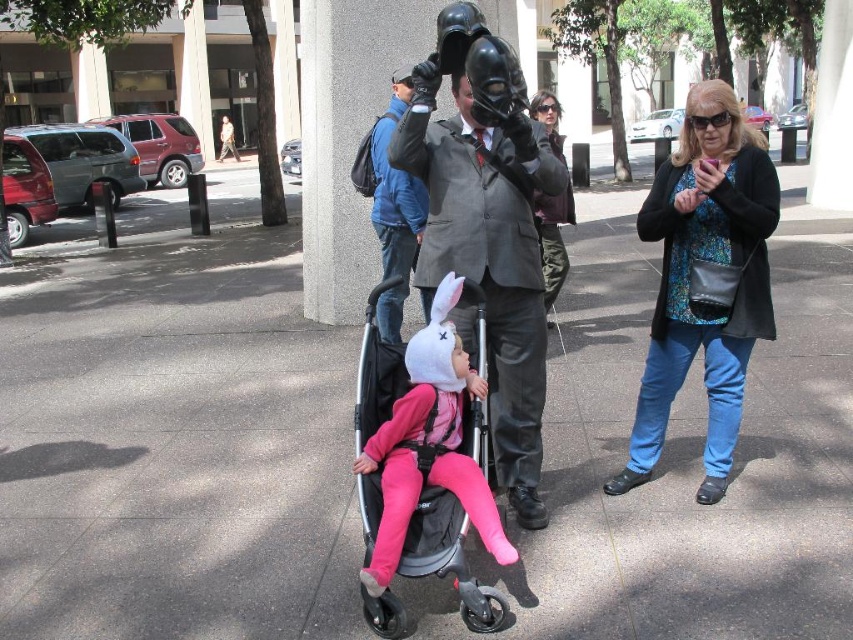
Does point (155, 211) lie behind point (492, 189)?

Yes, point (155, 211) is behind point (492, 189).

Which is behind, point (834, 237) or point (436, 184)?

Point (834, 237)

Who is more distant from viewer, (x=575, y=352) or (x=537, y=528)?

Point (x=575, y=352)

Where is `gray concrete pavement at center`? The width and height of the screenshot is (853, 640). gray concrete pavement at center is located at coordinates (173, 442).

Which is below, gray concrete pavement at center or black matte baby carriage at center?

black matte baby carriage at center is below.

Looking at this image, is gray concrete pavement at center to the left of black matte baby carriage at center from the viewer's perspective?

Indeed, gray concrete pavement at center is positioned on the left side of black matte baby carriage at center.

Locate an element on the screen. The height and width of the screenshot is (640, 853). gray concrete pavement at center is located at coordinates (173, 442).

This screenshot has width=853, height=640. I want to click on gray concrete pavement at center, so click(x=173, y=442).

Is matte black suit at center behind blue denim jacket at center?

No, it is in front of blue denim jacket at center.

Is the position of matte black suit at center less distant than that of blue denim jacket at center?

Yes, it is.

Who is more forward, (387, 148) or (401, 84)?

Point (387, 148)

This screenshot has width=853, height=640. I want to click on matte black suit at center, so click(x=489, y=250).